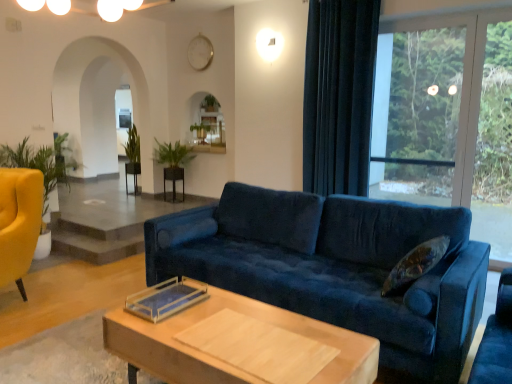
The image size is (512, 384). I want to click on free space on the front side of black wood side table at center, the 1th side table from the front, so click(x=168, y=203).